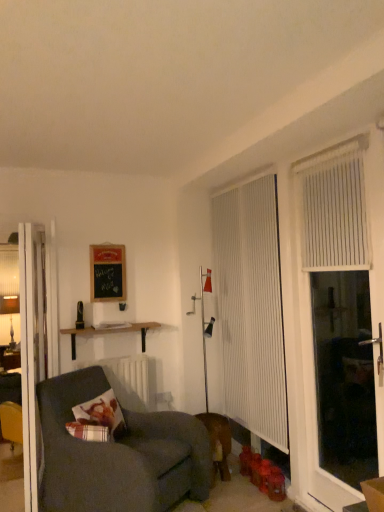
Question: Does white vertical blinds at right, which appears as the second curtain when viewed from the back, have a lesser width compared to white glossy door at left?

Choices:
 (A) no
 (B) yes

Answer: (B)

Question: Can you confirm if white vertical blinds at right, the 1th curtain viewed from the front, is taller than white glossy door at left?

Choices:
 (A) yes
 (B) no

Answer: (B)

Question: From a real-world perspective, is white vertical blinds at right, which appears as the second curtain when viewed from the back, located beneath white glossy door at left?

Choices:
 (A) yes
 (B) no

Answer: (B)

Question: Can you confirm if white vertical blinds at right, the 1th curtain viewed from the front, is positioned to the left of white glossy door at left?

Choices:
 (A) yes
 (B) no

Answer: (B)

Question: Is white glossy door at left surrounded by white vertical blinds at right, the 2th curtain viewed from the left?

Choices:
 (A) no
 (B) yes

Answer: (A)

Question: Are white vertical blinds at right, the 2th curtain viewed from the left, and white glossy door at left making contact?

Choices:
 (A) yes
 (B) no

Answer: (B)

Question: Is wooden shelf at upper left smaller than white glossy door at left?

Choices:
 (A) yes
 (B) no

Answer: (A)

Question: Is wooden shelf at upper left with white glossy door at left?

Choices:
 (A) yes
 (B) no

Answer: (B)

Question: Could white glossy door at left be considered to be inside wooden shelf at upper left?

Choices:
 (A) no
 (B) yes

Answer: (A)

Question: Is wooden shelf at upper left closer to camera compared to white glossy door at left?

Choices:
 (A) no
 (B) yes

Answer: (A)

Question: Does wooden shelf at upper left lie behind white glossy door at left?

Choices:
 (A) yes
 (B) no

Answer: (A)

Question: From the image's perspective, is wooden shelf at upper left beneath white glossy door at left?

Choices:
 (A) no
 (B) yes

Answer: (A)

Question: From the image's perspective, does dark gray fabric couch at lower left appear higher than black chalkboard at upper left?

Choices:
 (A) yes
 (B) no

Answer: (B)